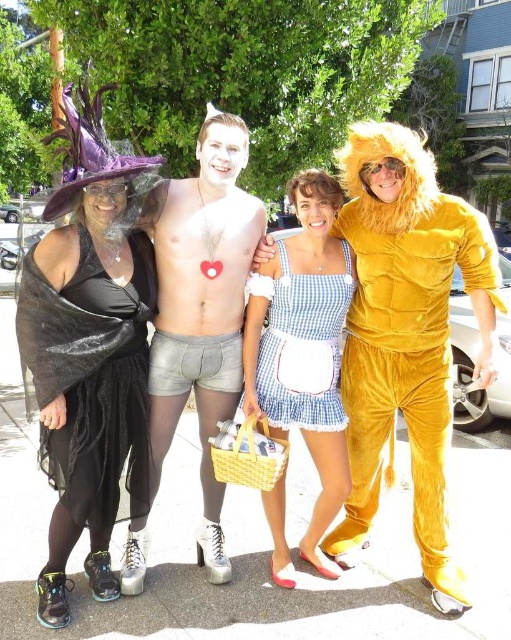
Question: Does black mesh dress at left appear under blue checkered dress at center?

Choices:
 (A) yes
 (B) no

Answer: (A)

Question: Can you confirm if velvet yellow lion at right is positioned to the left of black mesh dress at left?

Choices:
 (A) no
 (B) yes

Answer: (A)

Question: Based on their relative distances, which object is nearer to the velvet yellow lion at right?

Choices:
 (A) black mesh dress at left
 (B) blue checkered dress at center
 (C) metallic silver shorts at center

Answer: (B)

Question: Is metallic silver shorts at center to the left of black mesh dress at left from the viewer's perspective?

Choices:
 (A) no
 (B) yes

Answer: (A)

Question: Estimate the real-world distances between objects in this image. Which object is farther from the black mesh dress at left?

Choices:
 (A) velvet yellow lion at right
 (B) blue checkered dress at center

Answer: (A)

Question: Which point is farther to the camera?

Choices:
 (A) checkered fabric dress at center
 (B) black mesh dress at left

Answer: (A)